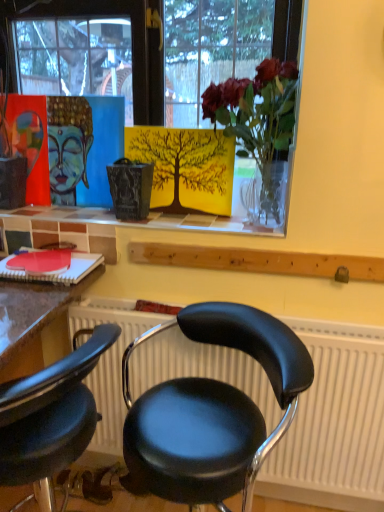
At what (x,y) coordinates should I click in order to perform the action: click on vacant space in translucent glass vase at upper center (from a real-world perspective). Please return your answer as a coordinate pair (x, y). This screenshot has width=384, height=512. Looking at the image, I should click on (231, 225).